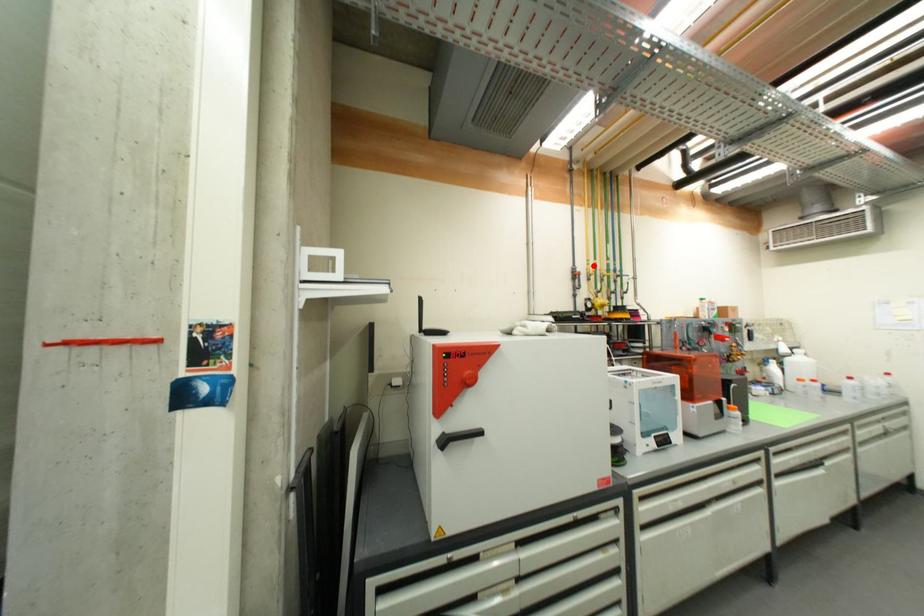
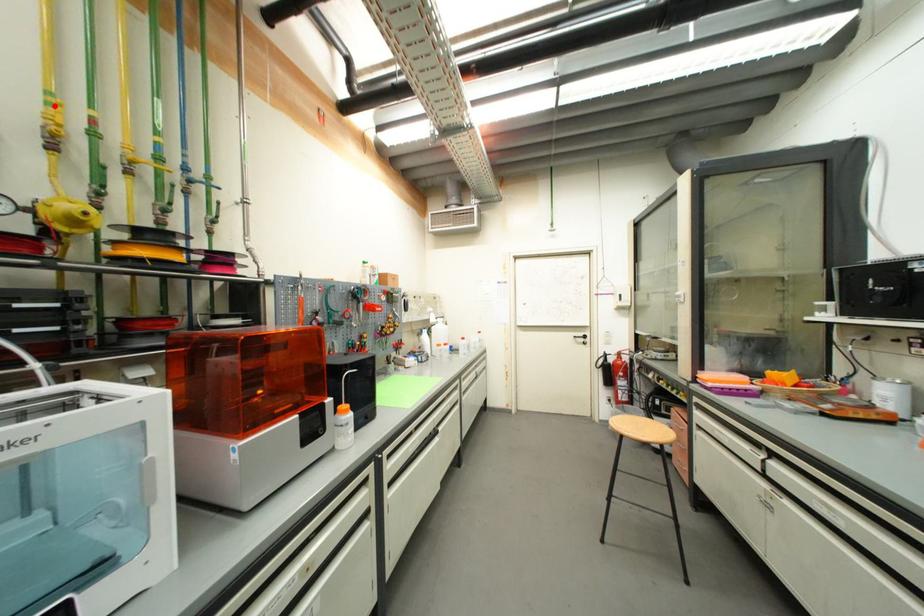
From the picture: I am providing you with two images of the same scene from different viewpoints. A red point is marked on the first image and another point is marked on the second image. Are the points marked in image1 and image2 representing the same 3D position?

Yes